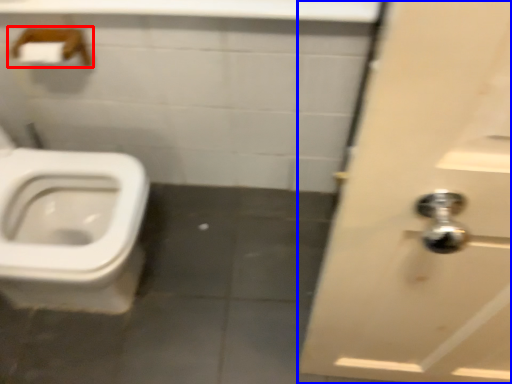
Question: Which of the following is the closest to the observer, towel bar (highlighted by a red box) or door (highlighted by a blue box)?

Choices:
 (A) towel bar
 (B) door

Answer: (B)